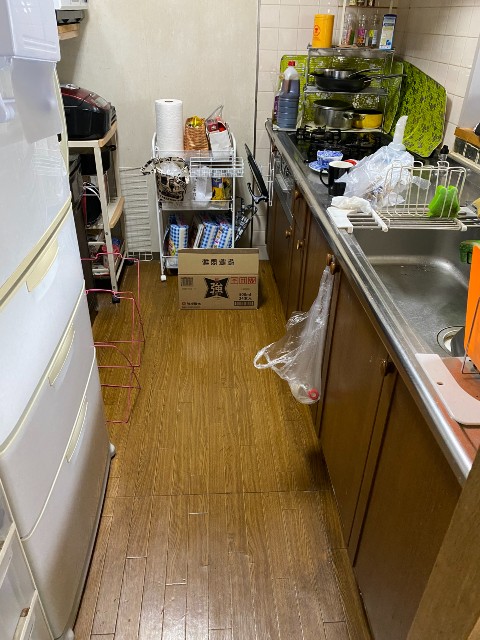
Locate an element on the screen. cooking pans is located at coordinates (334, 122), (334, 79).